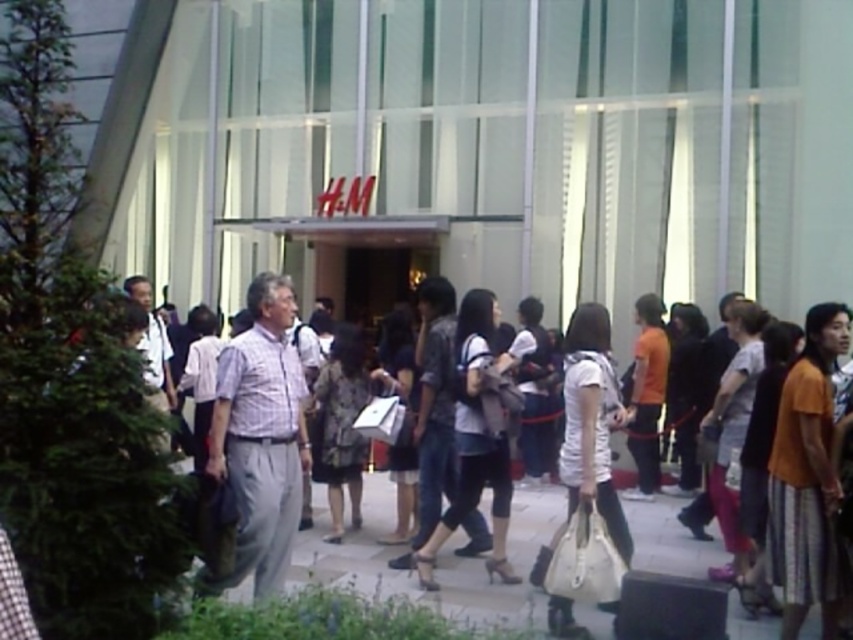
Question: Does leather beige handbag at lower center have a lesser width compared to white shirt at center?

Choices:
 (A) yes
 (B) no

Answer: (A)

Question: Based on their relative distances, which object is farther from the leather beige handbag at lower center?

Choices:
 (A) white shirt at center
 (B) smooth concrete pavement at center

Answer: (A)

Question: Does light brown fabric shirt at center appear on the right side of white shirt at center?

Choices:
 (A) yes
 (B) no

Answer: (A)

Question: Is light brown fabric shirt at center thinner than white shirt at center?

Choices:
 (A) yes
 (B) no

Answer: (A)

Question: Which of these objects is positioned closest to the leather beige handbag at lower center?

Choices:
 (A) smooth concrete pavement at center
 (B) white shirt at center
 (C) light brown fabric shirt at center

Answer: (C)

Question: Which object is the closest to the smooth concrete pavement at center?

Choices:
 (A) white shirt at center
 (B) leather beige handbag at lower center

Answer: (B)